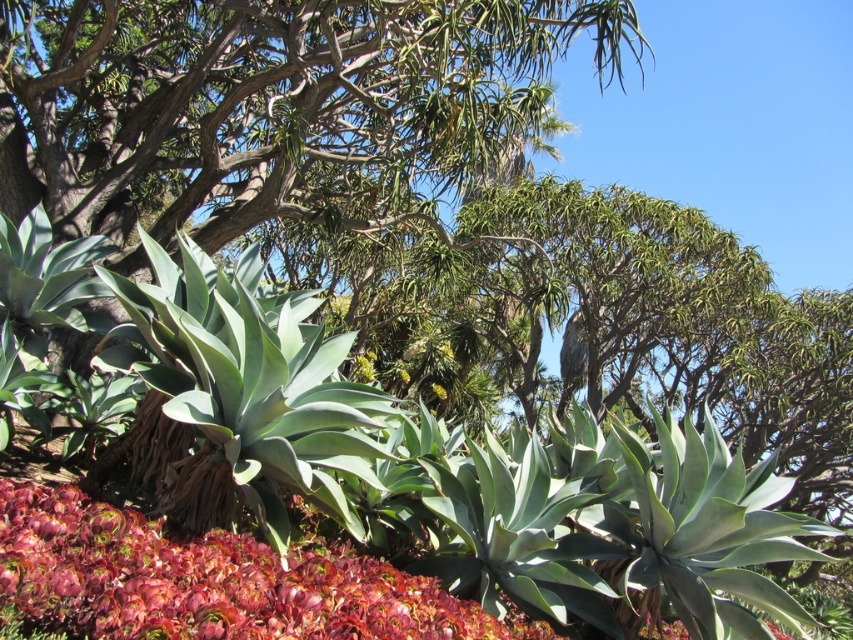
You are a gardener who needs to determine which plant has a thicker stem between the green leafy tree at center and the smooth red flower at lower left. Based on the scene, which one would you choose?

The smooth red flower at lower left has a thicker stem than the green leafy tree at center.

You are planning to plant a new tree in your garden. You have a space that can accommodate a tree no larger than the green leafy tree at center. Can the smooth red flower at lower left be planted in this space without overcrowding?

The green leafy tree at center is smaller than the smooth red flower at lower left. Therefore, the space allocated for the tree may not be sufficient to plant the smooth red flower at lower left without overcrowding.

You are a gardener planning to plant a new tree that requires at least 10 meters of space. You observe the green leafy tree at center and the smooth red flower at lower left. Which object is shorter and would require less space for planting?

The green leafy tree at center is shorter than the smooth red flower at lower left, so it would require less space for planting.